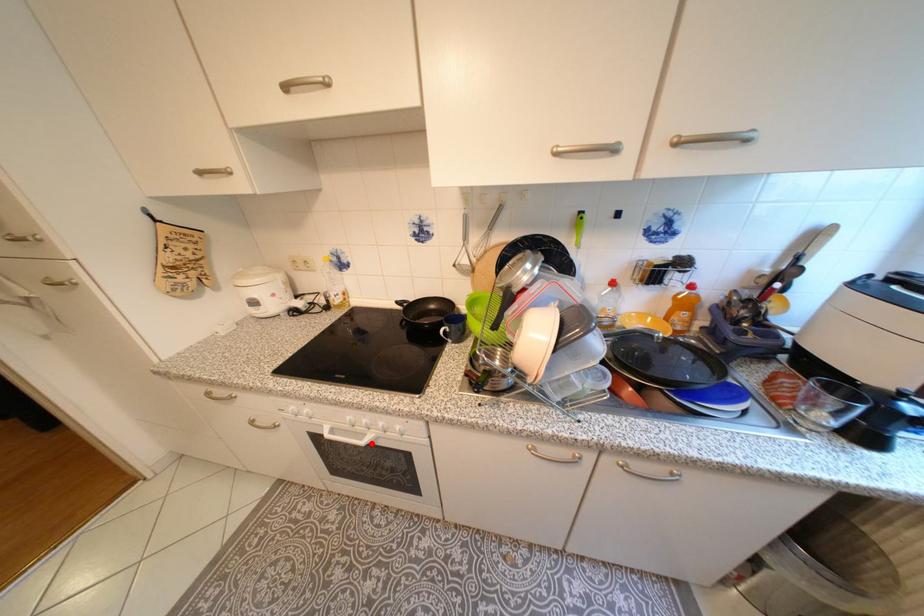
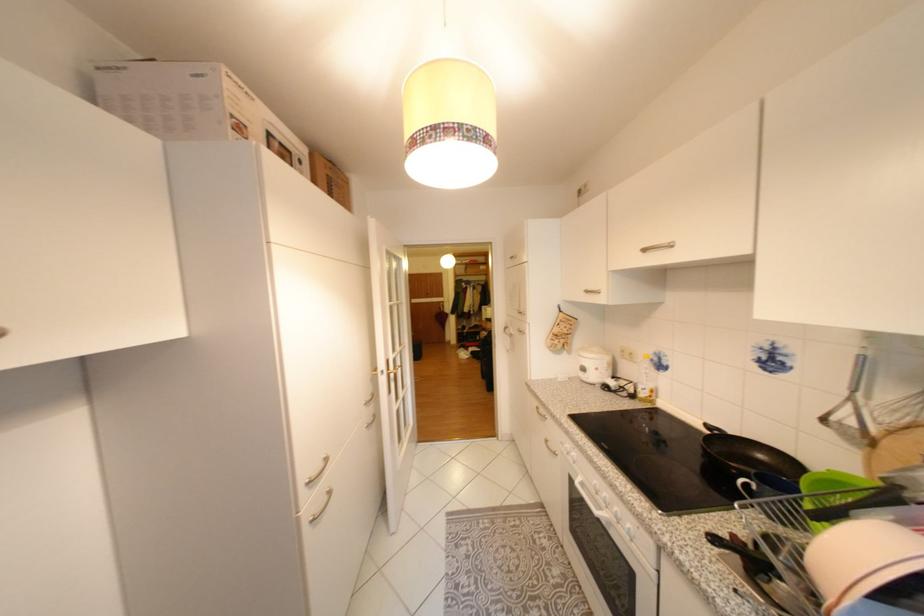
Question: I am providing you with two images of the same scene from different viewpoints. Given a red point in image1, look at the same physical point in image2. Is it:

Choices:
 (A) Closer to the viewpoint
 (B) Farther from the viewpoint

Answer: (A)